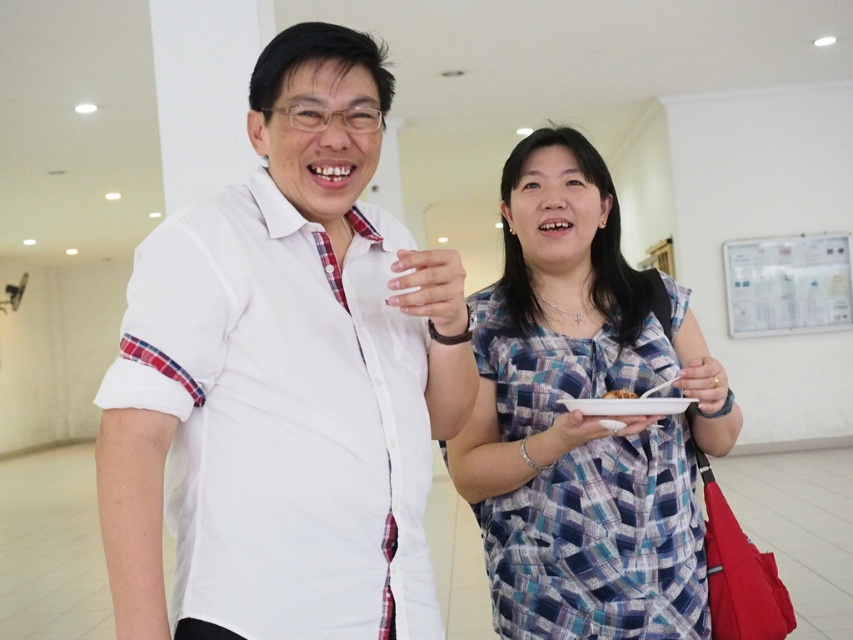
Does white cotton shirt at center appear under white matte plate at center?

No.

Is point (187, 268) closer to viewer compared to point (614, 435)?

Yes, point (187, 268) is closer to viewer.

Identify the location of white cotton shirt at center. The width and height of the screenshot is (853, 640). (285, 380).

Is white matte plate at center to the left of smooth white plate at center from the viewer's perspective?

Indeed, white matte plate at center is positioned on the left side of smooth white plate at center.

Locate an element on the screen. This screenshot has width=853, height=640. white matte plate at center is located at coordinates (595, 428).

I want to click on white matte plate at center, so click(x=595, y=428).

Who is more distant from viewer, (207, 412) or (625, 388)?

Point (625, 388)

This screenshot has height=640, width=853. What are the coordinates of `white cotton shirt at center` in the screenshot? It's located at (285, 380).